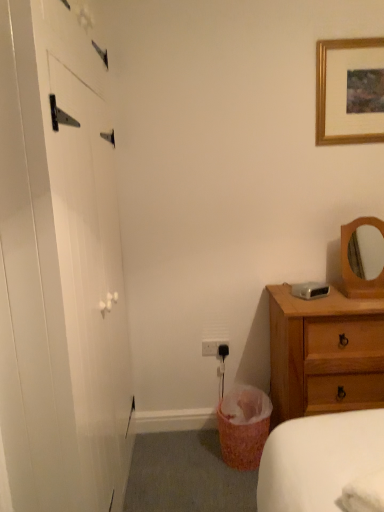
Question: Does gold wooden picture frame at upper right have a lesser height compared to pink woven laundry basket at lower center?

Choices:
 (A) no
 (B) yes

Answer: (A)

Question: Is gold wooden picture frame at upper right facing away from pink woven laundry basket at lower center?

Choices:
 (A) yes
 (B) no

Answer: (B)

Question: Considering the relative sizes of gold wooden picture frame at upper right and pink woven laundry basket at lower center in the image provided, is gold wooden picture frame at upper right bigger than pink woven laundry basket at lower center?

Choices:
 (A) no
 (B) yes

Answer: (A)

Question: From a real-world perspective, is gold wooden picture frame at upper right located higher than pink woven laundry basket at lower center?

Choices:
 (A) yes
 (B) no

Answer: (A)

Question: From a real-world perspective, is gold wooden picture frame at upper right physically below pink woven laundry basket at lower center?

Choices:
 (A) no
 (B) yes

Answer: (A)

Question: Does gold wooden picture frame at upper right appear on the left side of pink woven laundry basket at lower center?

Choices:
 (A) yes
 (B) no

Answer: (B)

Question: Considering the relative sizes of pink woven laundry basket at lower center and gold wooden picture frame at upper right in the image provided, is pink woven laundry basket at lower center taller than gold wooden picture frame at upper right?

Choices:
 (A) no
 (B) yes

Answer: (A)

Question: Is the position of pink woven laundry basket at lower center less distant than that of gold wooden picture frame at upper right?

Choices:
 (A) yes
 (B) no

Answer: (A)

Question: Considering the relative sizes of pink woven laundry basket at lower center and gold wooden picture frame at upper right in the image provided, is pink woven laundry basket at lower center shorter than gold wooden picture frame at upper right?

Choices:
 (A) no
 (B) yes

Answer: (B)

Question: Does pink woven laundry basket at lower center turn towards gold wooden picture frame at upper right?

Choices:
 (A) no
 (B) yes

Answer: (A)

Question: Does pink woven laundry basket at lower center lie behind gold wooden picture frame at upper right?

Choices:
 (A) yes
 (B) no

Answer: (B)

Question: Is pink woven laundry basket at lower center beside gold wooden picture frame at upper right?

Choices:
 (A) yes
 (B) no

Answer: (B)

Question: Is gold wooden picture frame at upper right closer to camera compared to white matte barn door at left?

Choices:
 (A) no
 (B) yes

Answer: (A)